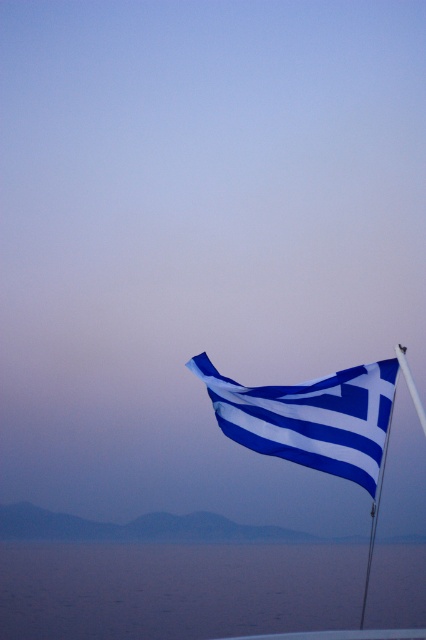
Question: Based on their relative distances, which object is nearer to the blue/white striped flag at center?

Choices:
 (A) metallic silver flag pole at right
 (B) blue water at lower center
 (C) metallic pole at right

Answer: (A)

Question: Among these objects, which one is farthest from the camera?

Choices:
 (A) metallic pole at right
 (B) blue/white striped flag at center
 (C) metallic silver flag pole at right
 (D) blue water at lower center

Answer: (D)

Question: Does blue water at lower center have a lesser width compared to metallic silver flag pole at right?

Choices:
 (A) no
 (B) yes

Answer: (A)

Question: Estimate the real-world distances between objects in this image. Which object is closer to the blue water at lower center?

Choices:
 (A) metallic silver flag pole at right
 (B) blue/white striped flag at center

Answer: (B)

Question: Can you confirm if blue water at lower center is bigger than blue/white striped flag at center?

Choices:
 (A) yes
 (B) no

Answer: (A)

Question: In this image, where is metallic silver flag pole at right located relative to metallic pole at right?

Choices:
 (A) above
 (B) below

Answer: (B)